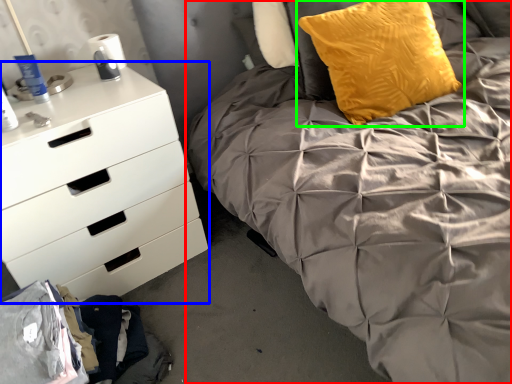
Question: Considering the real-world distances, which object is farthest from bed (highlighted by a red box)? chest of drawers (highlighted by a blue box) or pillow (highlighted by a green box)?

Choices:
 (A) chest of drawers
 (B) pillow

Answer: (A)